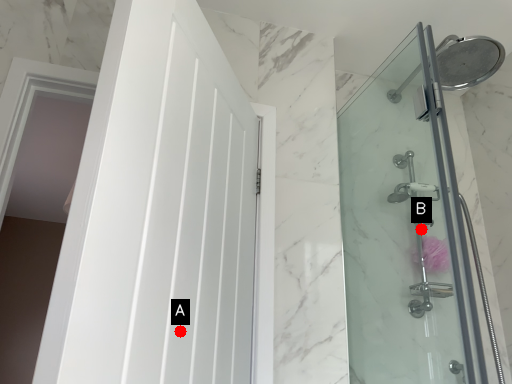
Question: Two points are circled on the image, labeled by A and B beside each circle. Which point is closer to the camera taking this photo?

Choices:
 (A) A is closer
 (B) B is closer

Answer: (A)